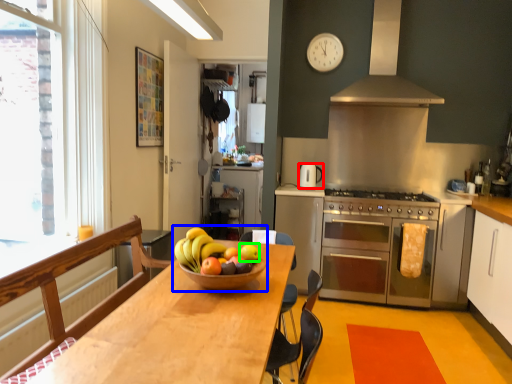
Question: Which object is positioned closest to kitchen appliance (highlighted by a red box)? Select from fruit dish (highlighted by a blue box) and apple (highlighted by a green box).

Choices:
 (A) fruit dish
 (B) apple

Answer: (B)